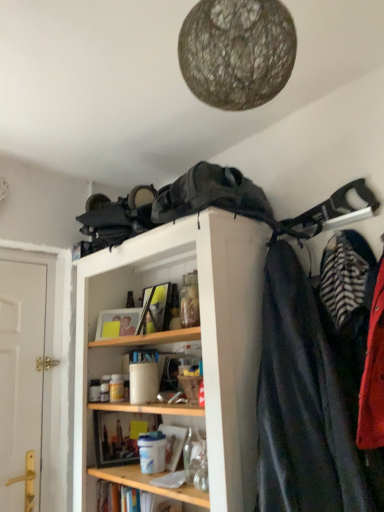
Question: Can you confirm if wooden shelf at lower center is taller than wooden shelf at upper center?

Choices:
 (A) no
 (B) yes

Answer: (A)

Question: Can you confirm if wooden shelf at lower center is positioned to the right of wooden shelf at upper center?

Choices:
 (A) no
 (B) yes

Answer: (A)

Question: Can you confirm if wooden shelf at lower center is thinner than wooden shelf at upper center?

Choices:
 (A) no
 (B) yes

Answer: (B)

Question: Does wooden shelf at lower center touch wooden shelf at upper center?

Choices:
 (A) no
 (B) yes

Answer: (A)

Question: From the image's perspective, is wooden shelf at lower center beneath wooden shelf at upper center?

Choices:
 (A) yes
 (B) no

Answer: (A)

Question: In terms of width, does striped fabric coat at right, the 2th cloak positioned from the top, look wider or thinner when compared to white wooden door at left?

Choices:
 (A) wide
 (B) thin

Answer: (A)

Question: From a real-world perspective, is striped fabric coat at right, placed as the second cloak when sorted from left to right, physically located above or below white wooden door at left?

Choices:
 (A) above
 (B) below

Answer: (A)

Question: Based on their sizes in the image, would you say striped fabric coat at right, placed as the second cloak when sorted from left to right, is bigger or smaller than white wooden door at left?

Choices:
 (A) big
 (B) small

Answer: (A)

Question: From the image's perspective, is striped fabric coat at right, the first cloak in the right-to-left sequence, positioned above or below white wooden door at left?

Choices:
 (A) below
 (B) above

Answer: (B)

Question: Is wooden shelf at lower center taller or shorter than white wooden door at left?

Choices:
 (A) tall
 (B) short

Answer: (B)

Question: In the image, is wooden shelf at lower center positioned in front of or behind white wooden door at left?

Choices:
 (A) behind
 (B) front

Answer: (B)

Question: Choose the correct answer: Is wooden shelf at lower center inside white wooden door at left or outside it?

Choices:
 (A) outside
 (B) inside

Answer: (A)

Question: Based on their positions, is wooden shelf at lower center located to the left or right of white wooden door at left?

Choices:
 (A) right
 (B) left

Answer: (A)

Question: Would you say striped fabric coat at right, placed as the second cloak when sorted from left to right, is to the left or to the right of wooden shelf at upper center in the picture?

Choices:
 (A) right
 (B) left

Answer: (A)

Question: Considering the positions of striped fabric coat at right, the 2th cloak positioned from the top, and wooden shelf at upper center in the image, is striped fabric coat at right, the 2th cloak positioned from the top, bigger or smaller than wooden shelf at upper center?

Choices:
 (A) big
 (B) small

Answer: (B)